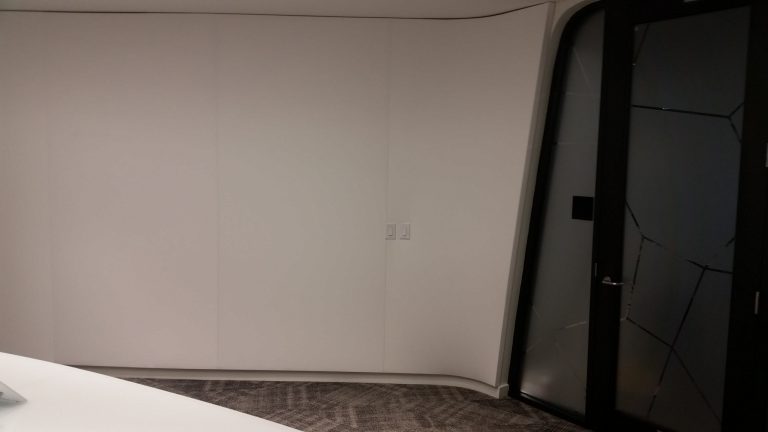
Where is `door handle`? door handle is located at coordinates (607, 284).